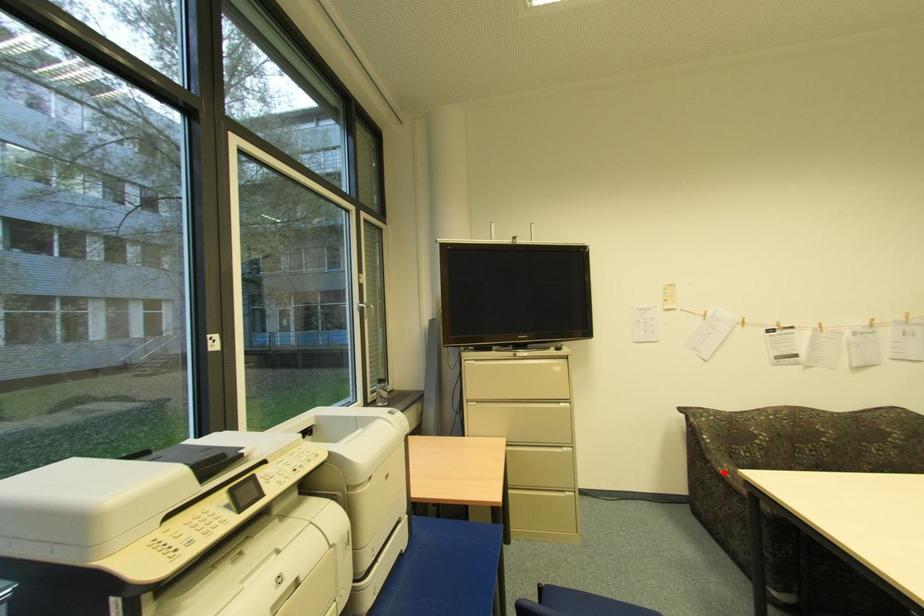
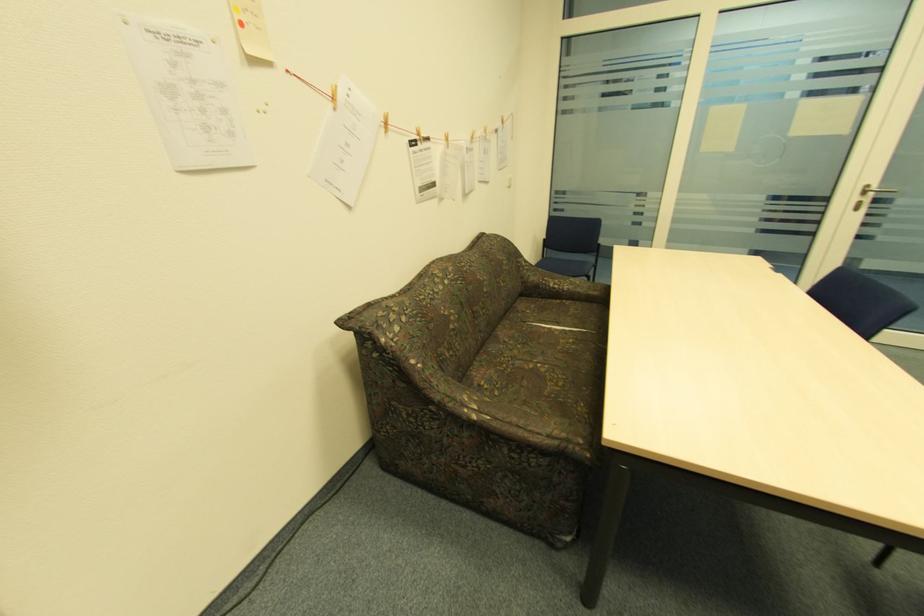
Locate, in the second image, the point that corresponds to the highlighted location in the first image.

(477, 416)